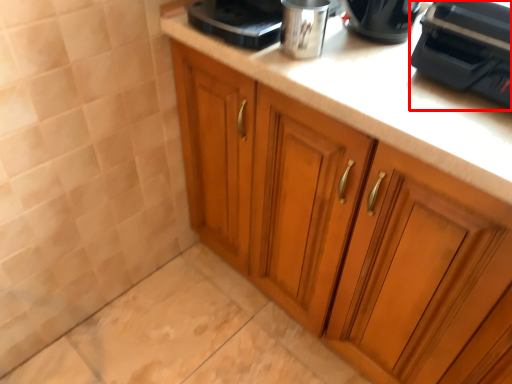
Question: Observing the image, what is the correct spatial positioning of home appliance (annotated by the red box) in reference to cabinetry?

Choices:
 (A) left
 (B) right

Answer: (B)